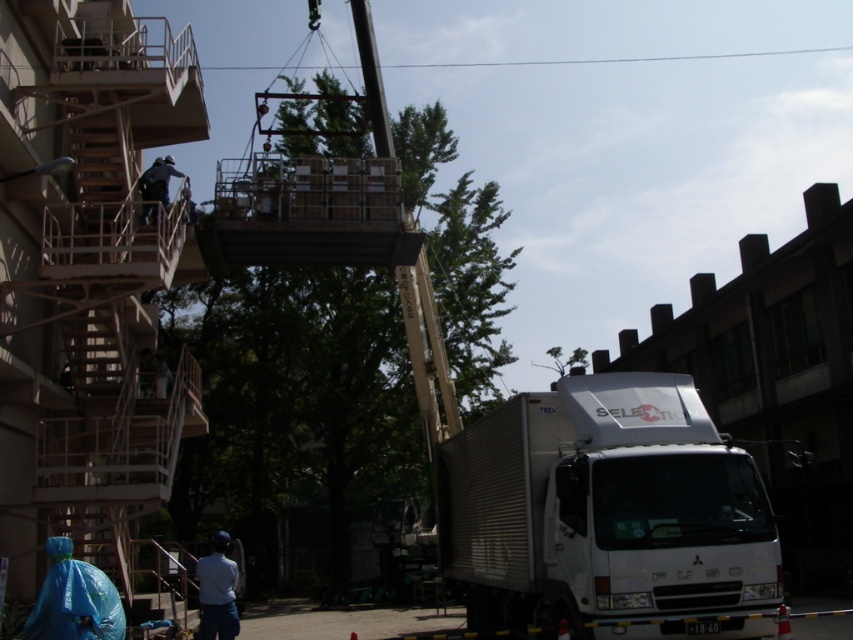
You are a delivery driver who needs to park your white metallic truck at lower right as close as possible to the dark blue uniform at upper left without blocking the fire escape. Can you park the truck closer than 2 meters away?

The white metallic truck at lower right is bigger than the dark blue uniform at upper left, but the question of distance isn not addressed in the Objects Description. Therefore, I cannot determine if the truck can be parked within 2 meters based on the provided information.

You are standing at the center of the image. Which direction should you move to reach the white metallic truck at lower right?

You should move towards the lower right direction to reach the white metallic truck at lower right as it is located at point (x=602, y=508).

You are a delivery driver who needs to park your white metallic truck at lower right in a space that can only accommodate vehicles narrower than the dark blue uniform at upper left. Can your truck fit in that space?

The white metallic truck at lower right is wider than the dark blue uniform at upper left, so it cannot fit in the space that can only accommodate vehicles narrower than the dark blue uniform at upper left.